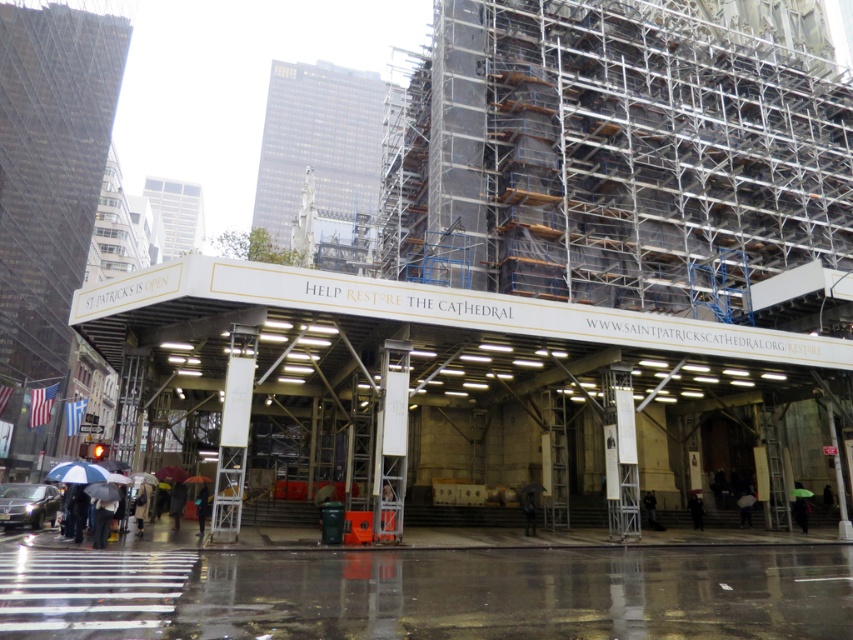
Question: Where is raincoat matte at lower left located in relation to shiny black sedan at lower left in the image?

Choices:
 (A) above
 (B) below

Answer: (A)

Question: Estimate the real-world distances between objects in this image. Which object is closer to the dark gray jacket at center?

Choices:
 (A) black fabric at lower right
 (B) white concrete parking garage at center
 (C) white matte umbrella at lower left

Answer: (A)

Question: Which of the following is the closest to the observer?

Choices:
 (A) black fabric at lower right
 (B) raincoat matte at lower left
 (C) white concrete parking garage at center

Answer: (B)

Question: Can you confirm if white concrete parking garage at center is thinner than raincoat matte at lower left?

Choices:
 (A) no
 (B) yes

Answer: (A)

Question: From the image, what is the correct spatial relationship of raincoat matte at lower left in relation to white matte umbrella at lower left?

Choices:
 (A) right
 (B) left

Answer: (A)

Question: Which of the following is the closest to the observer?

Choices:
 (A) (619, 518)
 (B) (210, 500)

Answer: (A)